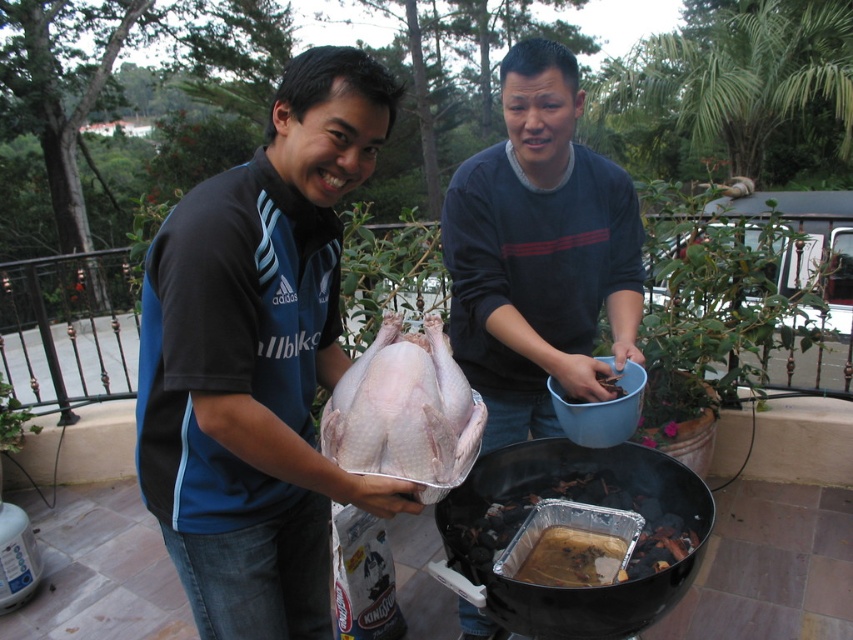
Can you confirm if matte blue shirt at center is wider than brown matte wood at center?

Yes, matte blue shirt at center is wider than brown matte wood at center.

Between matte blue shirt at center and brown matte wood at center, which one is positioned higher?

matte blue shirt at center is above.

This screenshot has height=640, width=853. What do you see at coordinates (258, 358) in the screenshot?
I see `matte blue shirt at center` at bounding box center [258, 358].

This screenshot has width=853, height=640. Find the location of `matte blue shirt at center`. matte blue shirt at center is located at coordinates (258, 358).

You are a GUI agent. You are given a task and a screenshot of the screen. Output one action in this format:
    pyautogui.click(x=<x>, y=<y>)
    Task: Click on the dark blue sweater at center
    The image size is (853, 640).
    Given the screenshot: What is the action you would take?
    pyautogui.click(x=538, y=252)

Who is more forward, (453, 326) or (624, 390)?

Point (624, 390)

At what (x,y) coordinates should I click in order to perform the action: click on dark blue sweater at center. Please return your answer as a coordinate pair (x, y). The width and height of the screenshot is (853, 640). Looking at the image, I should click on (538, 252).

Locate an element on the screen. dark blue sweater at center is located at coordinates (538, 252).

Which of these two, brown aluminum foil pan at lower center or brown matte wood at center, stands taller?

With more height is brown aluminum foil pan at lower center.

Between point (675, 504) and point (576, 396), which one is positioned in front?

Point (576, 396)

Identify the location of brown aluminum foil pan at lower center. (567, 499).